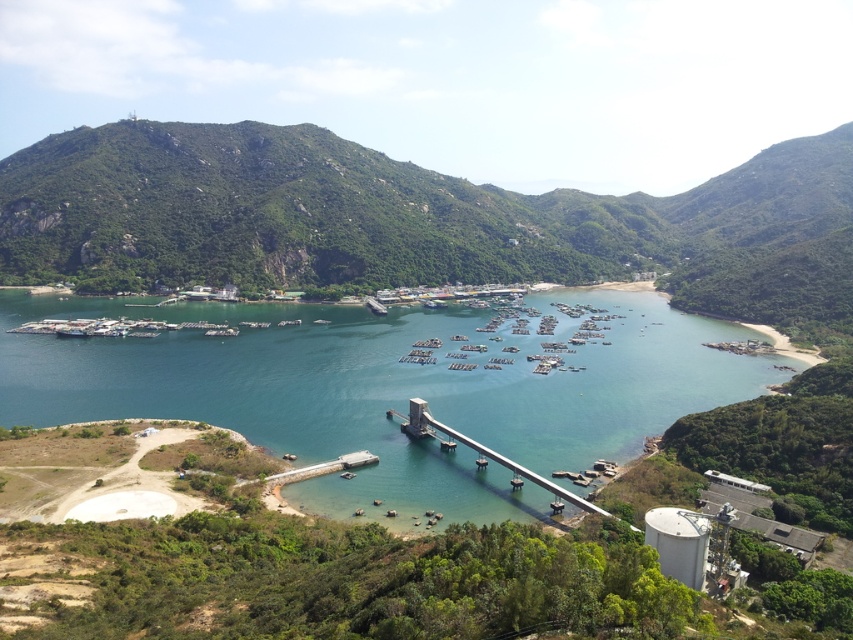
You are a drone operator planning to fly a drone over the coastal landscape. The drone has a limited flight path that must stay above the clear blue water at center and the metallic gray bridge at center. Based on their positions, which object should the drone prioritize flying over first when approaching from the left side of the image?

The clear blue water at center is located above the metallic gray bridge at center, so the drone should prioritize flying over the clear blue water at center first when approaching from the left side since it is positioned higher up.

Looking at this image, you are a hiker standing at the base of the green leafy mountain at center and want to reach the metallic gray bridge at center. Which direction should you head to get closer to the bridge?

A: You should head away from the green leafy mountain at center because it is closer to you than the metallic gray bridge at center, so moving away from the mountain will bring you closer to the bridge.

You are standing at the point marked as point (416, 220) in the image. What is the nearest object to you?

The nearest object to you at point (416, 220) is the green leafy mountain at center.